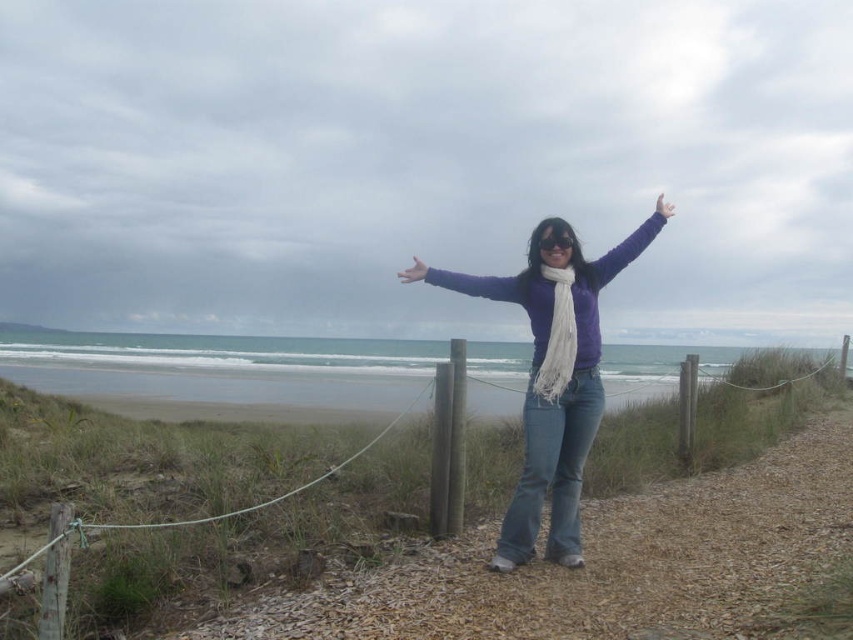
Question: Is purple soft sweater at center bigger than matte skin hand at upper center?

Choices:
 (A) no
 (B) yes

Answer: (A)

Question: Among these objects, which one is farthest from the camera?

Choices:
 (A) white soft scarf at center
 (B) matte white hand at upper right

Answer: (B)

Question: Is purple fabric arm at center thinner than purple matte scarf at upper center?

Choices:
 (A) yes
 (B) no

Answer: (A)

Question: Based on their relative distances, which object is farther from the purple soft sweater at center?

Choices:
 (A) white soft scarf at center
 (B) purple fabric arm at center
 (C) matte white hand at upper right

Answer: (C)

Question: Estimate the real-world distances between objects in this image. Which object is farther from the purple matte scarf at upper center?

Choices:
 (A) white soft scarf at center
 (B) purple fabric arm at center
 (C) matte skin hand at upper center
 (D) matte white hand at upper right

Answer: (C)

Question: Where is white soft scarf at center located in relation to matte skin hand at upper center in the image?

Choices:
 (A) below
 (B) above

Answer: (A)